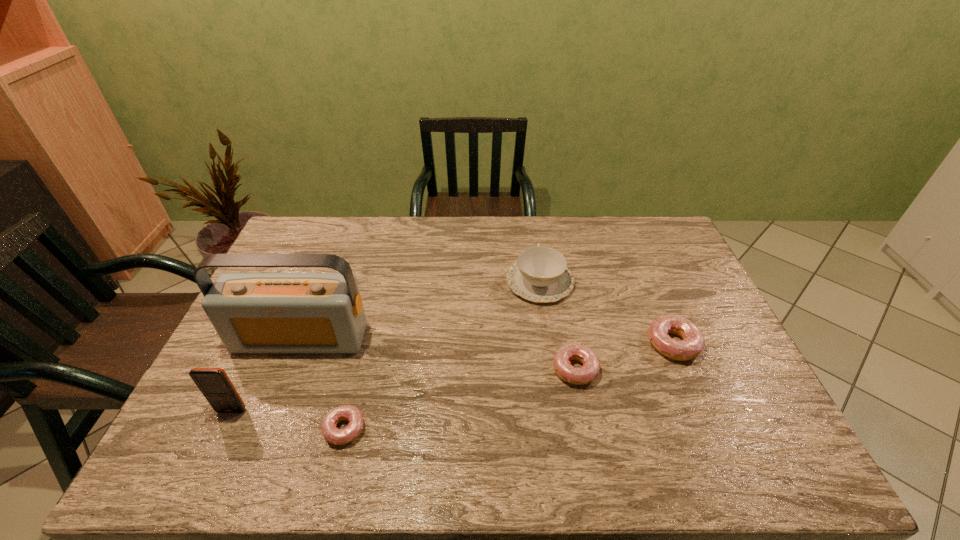
This screenshot has width=960, height=540. In order to click on the shortest doughnut in this screenshot , I will do `click(333, 435)`.

Image resolution: width=960 pixels, height=540 pixels. What are the coordinates of `the shortest object` in the screenshot? It's located at (333, 435).

Identify the location of the fifth tallest object. The image size is (960, 540). (588, 372).

What are the coordinates of `the second doughnut from right to left` in the screenshot? It's located at (588, 372).

In order to click on the rightmost doughnut in this screenshot , I will do `click(693, 342)`.

Where is `the rightmost object`? The width and height of the screenshot is (960, 540). the rightmost object is located at coordinates (693, 342).

Identify the location of radio receiver. (251, 312).

Identify the location of cellular telephone. The image size is (960, 540). (215, 385).

Locate an element on the screen. chinaware is located at coordinates (540, 274).

Locate an element on the screen. the farthest object is located at coordinates point(540,274).